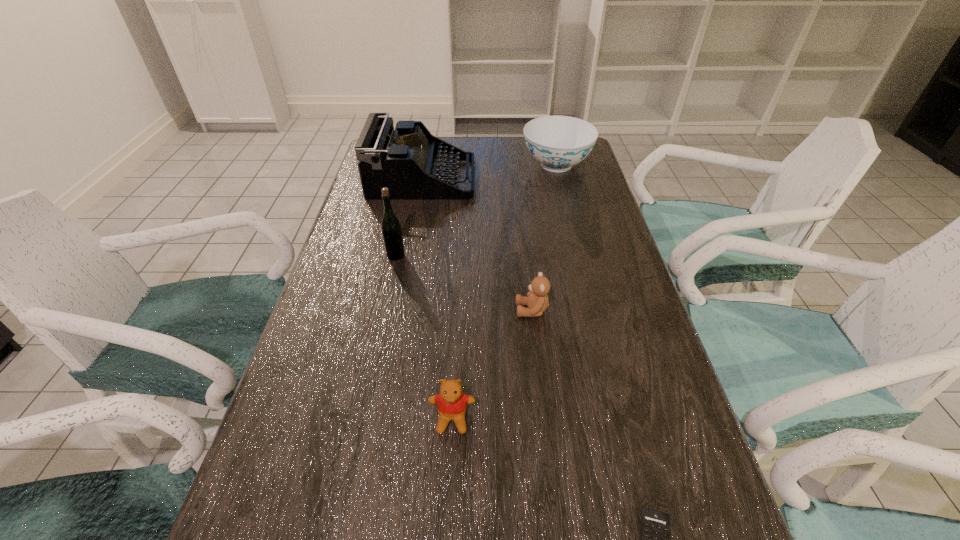
Locate an element on the screen. The image size is (960, 540). free space between the fourth shortest object and the fifth farthest object is located at coordinates (504, 292).

I want to click on the fourth closest object to the right teddy bear, so pyautogui.click(x=413, y=164).

Identify which object is the third nearest to the third tallest object. Please provide its 2D coordinates. Your answer should be formatted as a tuple, i.e. [(x, y)], where the tuple contains the x and y coordinates of a point satisfying the conditions above.

[(537, 301)]

At what (x,y) coordinates should I click in order to perform the action: click on free space that satisfies the following two spatial constraints: 1. on the face of the farther teddy bear; 2. on the front-facing side of the left teddy bear. Please return your answer as a coordinate pair (x, y). This screenshot has height=540, width=960. Looking at the image, I should click on (544, 419).